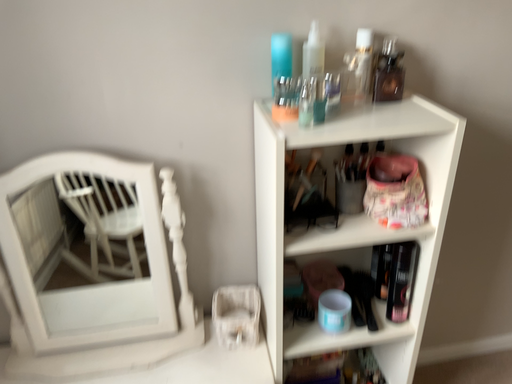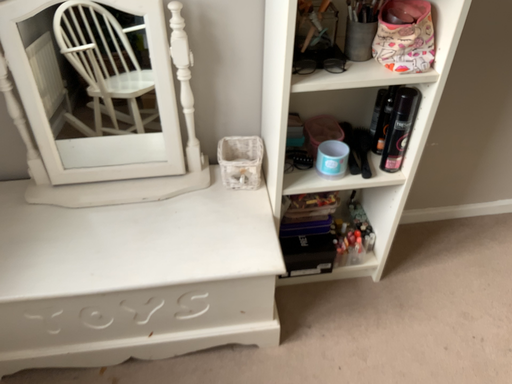
Question: Which way did the camera rotate in the video?

Choices:
 (A) rotated upward
 (B) rotated downward

Answer: (B)